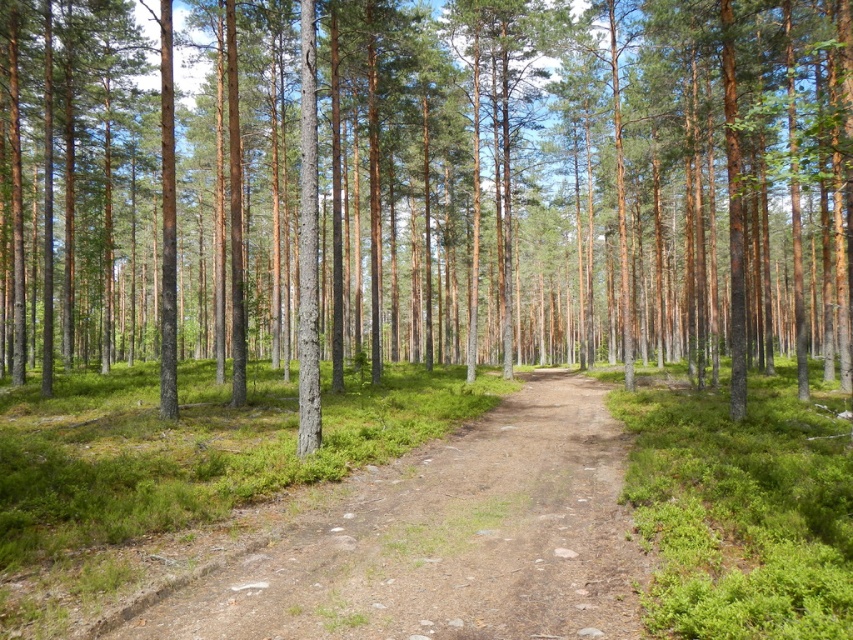
You are a hiker trying to determine the tallest object between the brown bark tree at center and the brown dirt track at center. Which one is taller?

The brown bark tree at center is taller than the brown dirt track at center.

From the picture: You are a hiker carrying a backpack and need to walk along the path in the forest. The brown bark tree at center and the brown dirt track at center are both in your way. Which one can you walk around more easily?

The brown dirt track at center can be walked around more easily since it is smaller in size compared to the brown bark tree at center, which is larger and harder to bypass.

You are a hiker walking along the dirt path in the forest. You notice two points marked on the map. The first point is at coordinates point (4, 308) and the second is at point (511, 573). If you are facing the direction of your hike, which point is located behind you?

Point (4, 308) is behind point (511, 573), so if you are facing the direction of your hike towards point (511, 573), then point (4, 308) would be behind you.